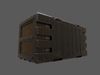
I want to click on large brown chest, so click(x=60, y=39).